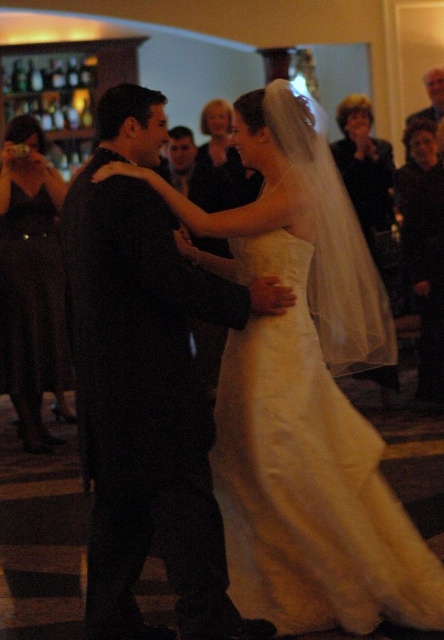
Question: Does black satin suit at center have a greater width compared to white satin dress at center?

Choices:
 (A) yes
 (B) no

Answer: (B)

Question: Is satin dress at center smaller than dark brown leather jacket at center?

Choices:
 (A) no
 (B) yes

Answer: (A)

Question: Which object is the farthest from the dark brown leather jacket at center?

Choices:
 (A) matte black dress at left
 (B) black satin suit at center
 (C) white satin dress at center

Answer: (C)

Question: Is black satin suit at center smaller than satin dress at center?

Choices:
 (A) yes
 (B) no

Answer: (A)

Question: Based on their relative distances, which object is nearer to the satin dress at center?

Choices:
 (A) black satin suit at center
 (B) dark brown leather jacket at center
 (C) matte black dress at left

Answer: (B)

Question: Which object appears closest to the camera in this image?

Choices:
 (A) white satin dress at center
 (B) satin dress at center

Answer: (A)